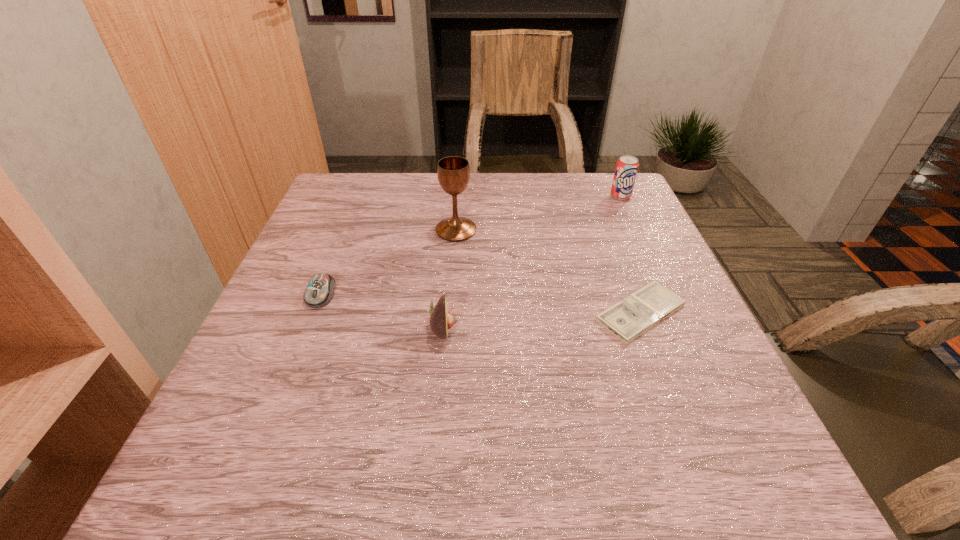
Identify the location of free space at the left edge. This screenshot has height=540, width=960. (336, 271).

This screenshot has width=960, height=540. In the image, there is a desktop. What are the coordinates of `free region at the right edge` in the screenshot? It's located at (664, 433).

Image resolution: width=960 pixels, height=540 pixels. I want to click on vacant space at the far left corner, so click(x=381, y=175).

I want to click on unoccupied area between the avocado and the farthest object, so click(x=532, y=262).

In order to click on free area in between the computer mouse and the shortest object in this screenshot , I will do pyautogui.click(x=481, y=303).

Find the location of a particular element. The image size is (960, 540). vacant space that is in between the shortest object and the leftmost object is located at coordinates (481, 303).

This screenshot has width=960, height=540. Identify the location of free space between the tallest object and the computer mouse. (x=389, y=262).

What are the coordinates of `free space that is in between the chalice and the computer mouse` in the screenshot? It's located at (389, 262).

This screenshot has width=960, height=540. I want to click on empty location between the soda can and the chalice, so coord(539,213).

Find the location of a particular element. This screenshot has height=540, width=960. free space that is in between the avocado and the second farthest object is located at coordinates (450, 279).